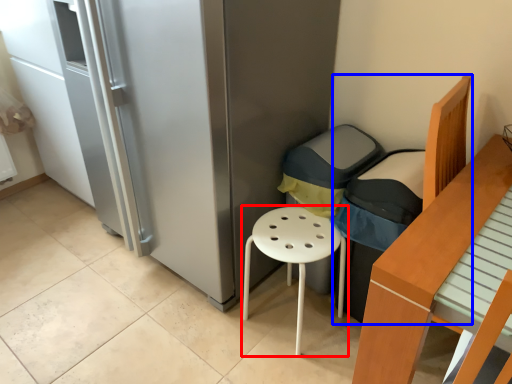
Question: Which object is further to the camera taking this photo, stool (highlighted by a red box) or armchair (highlighted by a blue box)?

Choices:
 (A) stool
 (B) armchair

Answer: (A)